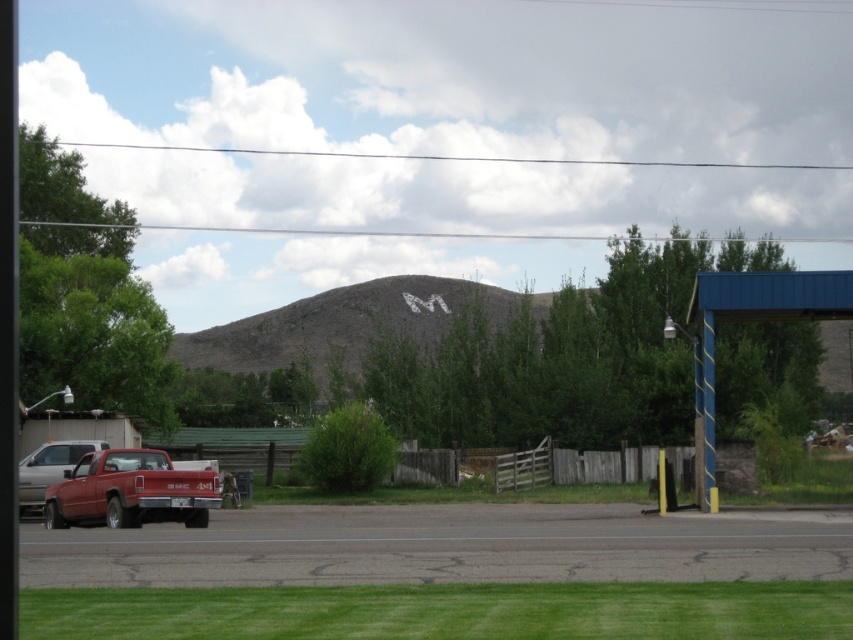
You are standing at the edge of the gray rocky mountain at center and want to walk to the matte red pickup truck at lower left. Which direction should you head?

You should head towards the lower left direction to reach the matte red pickup truck at lower left since it is closer to you than the gray rocky mountain at center.

You are a hiker standing at the base of the gray rocky mountain at center and want to reach the matte red truck at lower left. Which direction should you move to get there?

The gray rocky mountain at center is above the matte red truck at lower left, so you should move downward to reach the matte red truck at lower left.